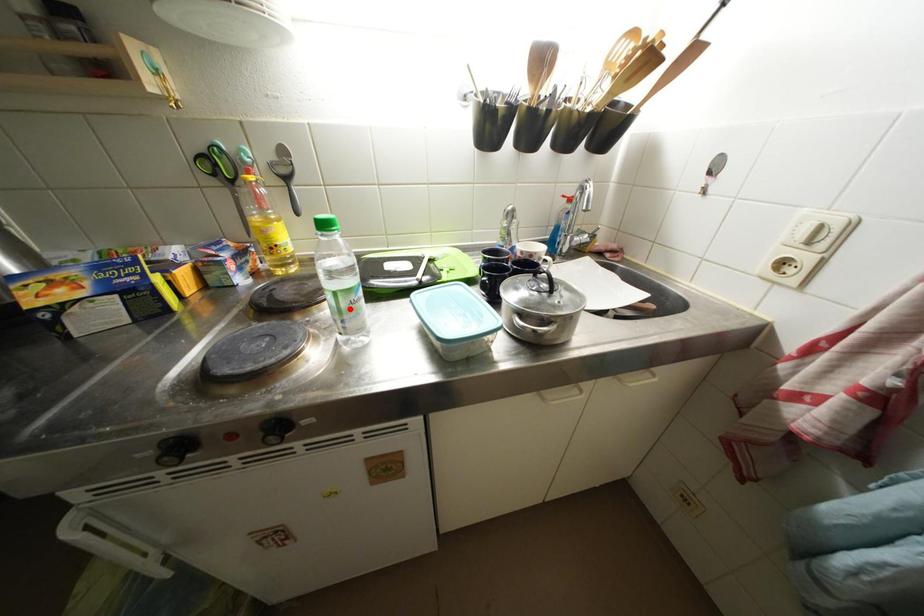
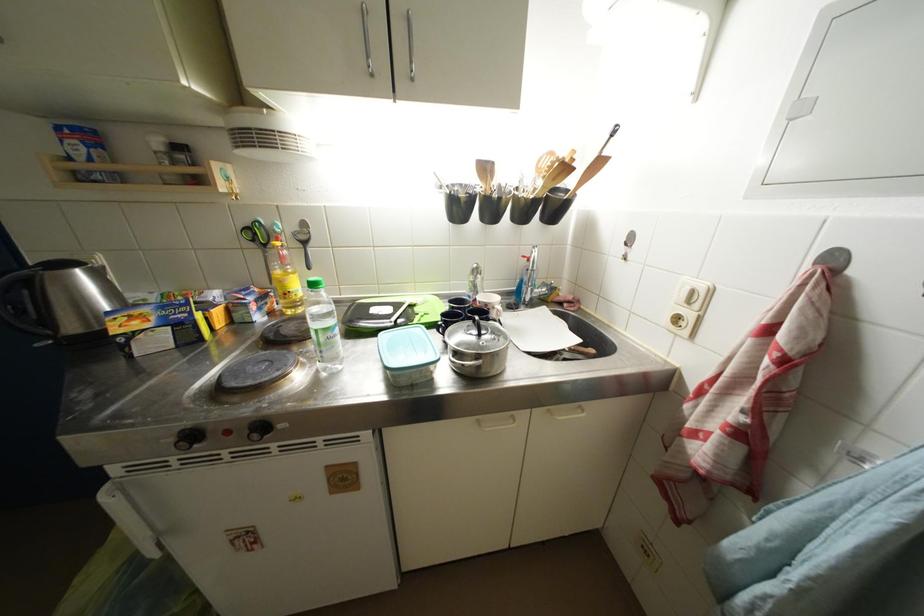
Question: I am providing you with two images of the same scene from different viewpoints. A red point is marked on the first image. Is the red point's position out of view in image 2?

Choices:
 (A) Yes
 (B) No

Answer: (B)